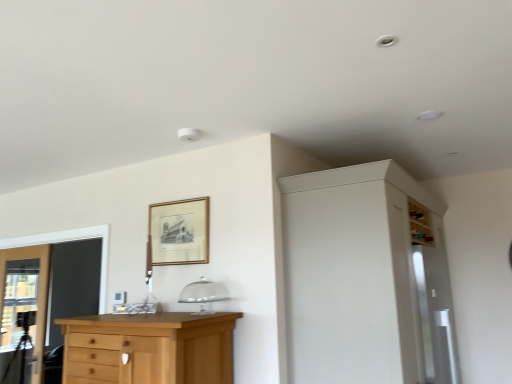
Question: From the image's perspective, is white matte cabinet at upper right below clear glass door at left?

Choices:
 (A) yes
 (B) no

Answer: (B)

Question: Does white matte cabinet at upper right appear on the left side of clear glass door at left?

Choices:
 (A) yes
 (B) no

Answer: (B)

Question: Could you tell me if white matte cabinet at upper right is facing clear glass door at left?

Choices:
 (A) no
 (B) yes

Answer: (A)

Question: Is the depth of white matte cabinet at upper right less than that of clear glass door at left?

Choices:
 (A) no
 (B) yes

Answer: (B)

Question: Does white matte cabinet at upper right have a lesser height compared to clear glass door at left?

Choices:
 (A) yes
 (B) no

Answer: (B)

Question: Is white matte cabinet at upper right next to clear glass door at left and touching it?

Choices:
 (A) no
 (B) yes

Answer: (A)

Question: Can you confirm if gold wooden picture frame at upper center is wider than white matte cabinet at upper right?

Choices:
 (A) no
 (B) yes

Answer: (A)

Question: Is gold wooden picture frame at upper center positioned behind white matte cabinet at upper right?

Choices:
 (A) yes
 (B) no

Answer: (A)

Question: Is gold wooden picture frame at upper center looking in the opposite direction of white matte cabinet at upper right?

Choices:
 (A) yes
 (B) no

Answer: (B)

Question: From the image's perspective, is gold wooden picture frame at upper center located beneath white matte cabinet at upper right?

Choices:
 (A) yes
 (B) no

Answer: (B)

Question: Considering the relative sizes of gold wooden picture frame at upper center and white matte cabinet at upper right in the image provided, is gold wooden picture frame at upper center taller than white matte cabinet at upper right?

Choices:
 (A) no
 (B) yes

Answer: (A)

Question: Is gold wooden picture frame at upper center surrounding white matte cabinet at upper right?

Choices:
 (A) yes
 (B) no

Answer: (B)

Question: Can you confirm if light brown wood chest of drawers at lower left is wider than transparent glass screen door at right?

Choices:
 (A) no
 (B) yes

Answer: (B)